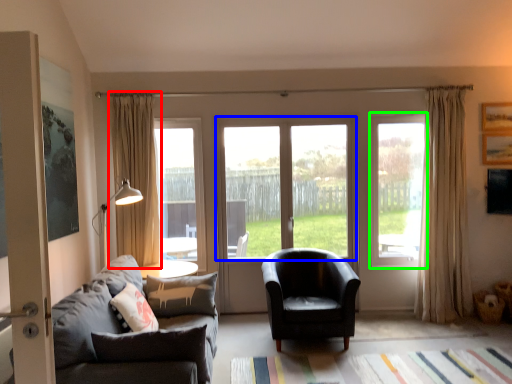
Question: Considering the real-world distances, which object is farthest from curtain (highlighted by a red box)? window (highlighted by a blue box) or window (highlighted by a green box)?

Choices:
 (A) window
 (B) window

Answer: (B)